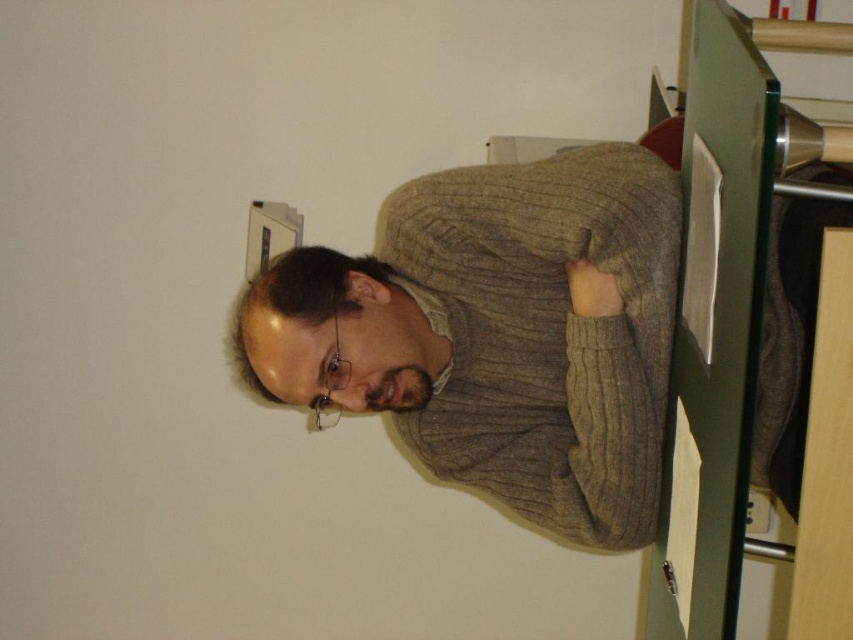
Can you confirm if knitted sweater at center is thinner than black plastic electric outlet at lower right?

No, knitted sweater at center is not thinner than black plastic electric outlet at lower right.

Looking at this image, can you confirm if knitted sweater at center is wider than black plastic electric outlet at lower right?

Correct, the width of knitted sweater at center exceeds that of black plastic electric outlet at lower right.

Which is behind, point (425, 308) or point (758, 532)?

The point (758, 532) is behind.

Where is `knitted sweater at center`? The width and height of the screenshot is (853, 640). knitted sweater at center is located at coordinates (497, 333).